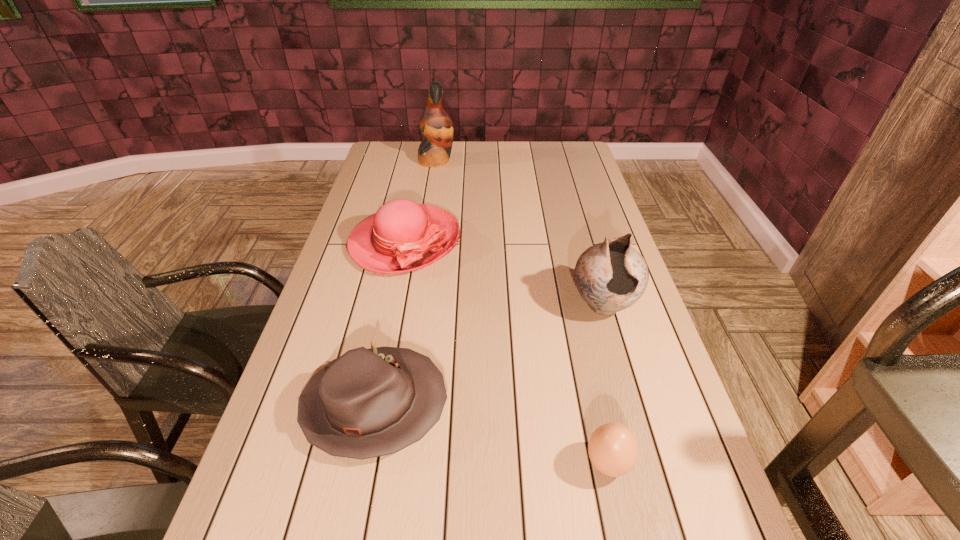
Where is `the farthest object`? the farthest object is located at coordinates (436, 125).

Where is `parrot`? parrot is located at coordinates (436, 125).

Locate an element on the screen. Image resolution: width=960 pixels, height=540 pixels. pottery is located at coordinates (611, 276).

You are a GUI agent. You are given a task and a screenshot of the screen. Output one action in this format:
    pyautogui.click(x=<x>, y=<y>)
    Task: Click on the second tallest object
    This screenshot has height=540, width=960.
    Given the screenshot: What is the action you would take?
    pyautogui.click(x=611, y=276)

At what (x,y) coordinates should I click in order to perform the action: click on the third tallest object. Please return your answer as a coordinate pair (x, y). The height and width of the screenshot is (540, 960). Looking at the image, I should click on (402, 236).

I want to click on the taller hat, so click(x=402, y=236).

Locate an element on the screen. Image resolution: width=960 pixels, height=540 pixels. the shorter hat is located at coordinates (367, 403).

Find the location of a particular element. This screenshot has height=540, width=960. boiled egg is located at coordinates (612, 448).

Locate an element on the screen. The width and height of the screenshot is (960, 540). vacant space situated 0.180m on the face of the tallest object is located at coordinates (499, 161).

Find the location of a particular element. vacant space located from the spout of the fourth shortest object is located at coordinates (644, 447).